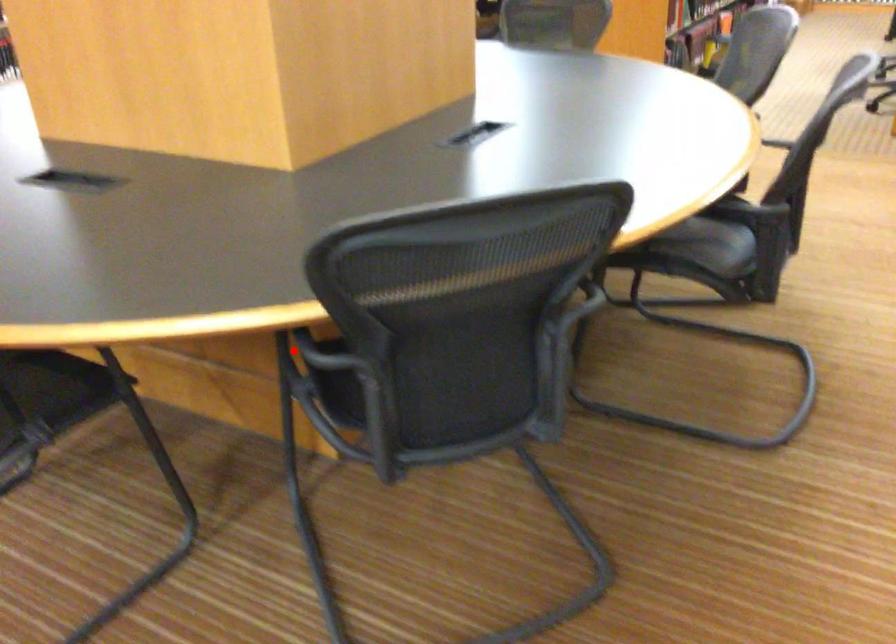
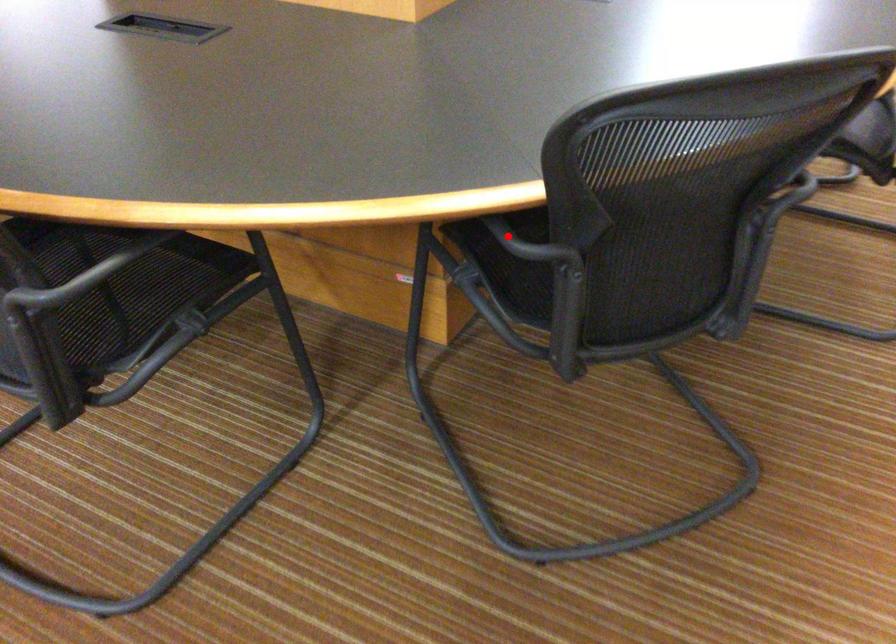
I am providing you with two images of the same scene from different viewpoints. A red point is marked on the first image and another point is marked on the second image. Is the red point in image1 aligned with the point shown in image2?

Yes